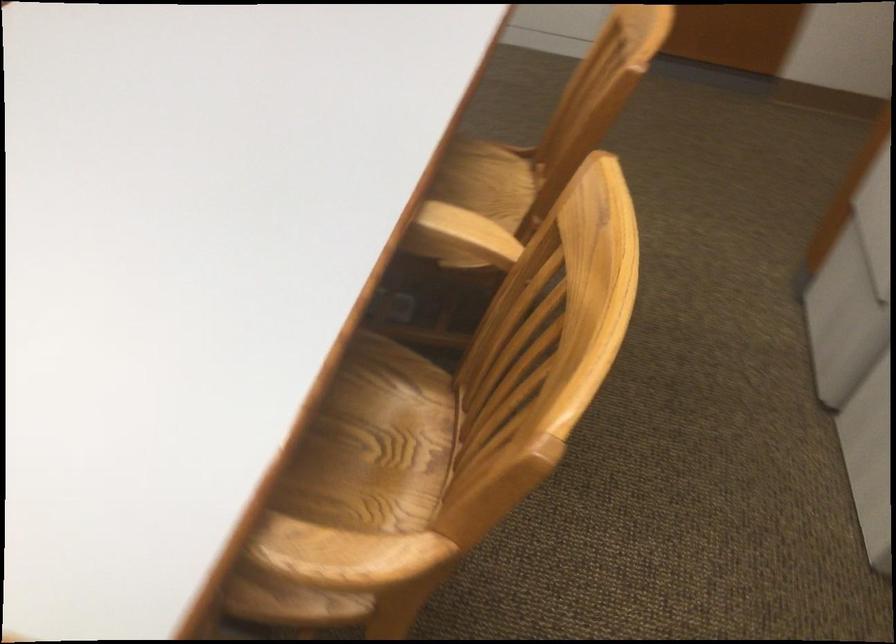
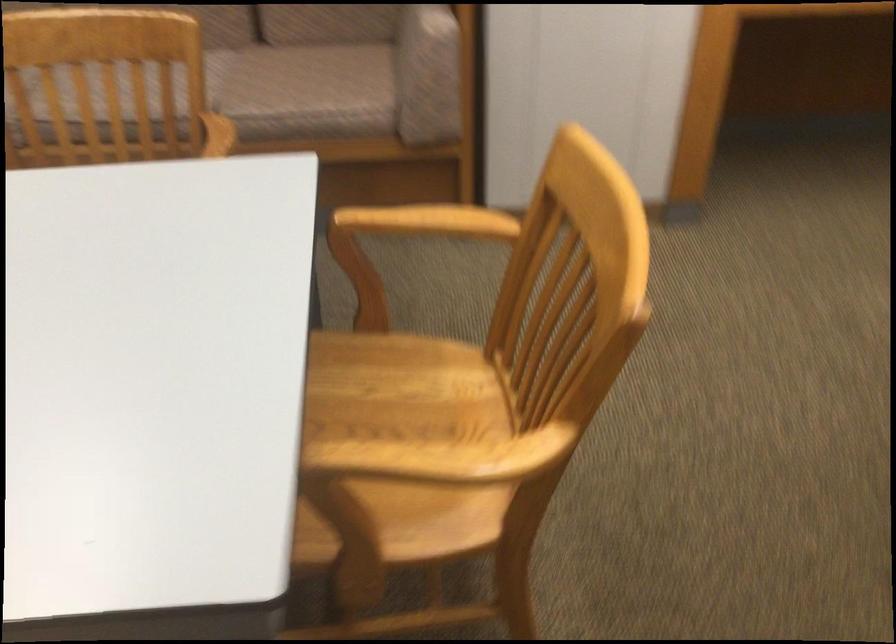
Question: How did the camera likely rotate?

Choices:
 (A) Left
 (B) Right
 (C) Up
 (D) Down

Answer: (A)